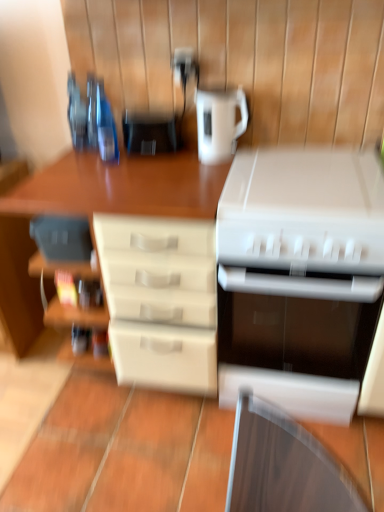
Question: Is matte black coffee maker at center, the 2th appliance from the bottom, smaller than white plastic printer at lower right, placed as the 1th kitchen appliance when sorted from bottom to top?

Choices:
 (A) no
 (B) yes

Answer: (B)

Question: From the image's perspective, is matte black coffee maker at center, which appears as the 1th appliance when viewed from the top, on white plastic printer at lower right, placed as the 1th kitchen appliance when sorted from bottom to top?

Choices:
 (A) no
 (B) yes

Answer: (B)

Question: Does matte black coffee maker at center, which appears as the 2th appliance when viewed from the right, have a greater height compared to white plastic printer at lower right, the 2th kitchen appliance in the top-to-bottom sequence?

Choices:
 (A) no
 (B) yes

Answer: (A)

Question: Is matte black coffee maker at center, the 2th appliance from the bottom, shorter than white plastic printer at lower right, the 2th kitchen appliance in the top-to-bottom sequence?

Choices:
 (A) yes
 (B) no

Answer: (A)

Question: From a real-world perspective, is matte black coffee maker at center, which is counted as the first appliance, starting from the left, below white plastic printer at lower right, the 2th kitchen appliance in the top-to-bottom sequence?

Choices:
 (A) no
 (B) yes

Answer: (A)

Question: Is matte black coffee maker at center, which appears as the 2th appliance when viewed from the right, bigger than white plastic printer at lower right, placed as the 1th kitchen appliance when sorted from bottom to top?

Choices:
 (A) no
 (B) yes

Answer: (A)

Question: Is white plastic printer at center not within matte black coffee maker at center, which is counted as the first appliance, starting from the left?

Choices:
 (A) yes
 (B) no

Answer: (A)

Question: Is white plastic printer at center thinner than matte black coffee maker at center, which is counted as the first appliance, starting from the left?

Choices:
 (A) yes
 (B) no

Answer: (B)

Question: Is matte black coffee maker at center, the 2th appliance from the bottom, surrounded by white plastic printer at center?

Choices:
 (A) yes
 (B) no

Answer: (B)

Question: Considering the relative sizes of white plastic printer at center and matte black coffee maker at center, which appears as the 2th appliance when viewed from the right, in the image provided, is white plastic printer at center smaller than matte black coffee maker at center, which appears as the 2th appliance when viewed from the right,?

Choices:
 (A) no
 (B) yes

Answer: (A)

Question: Is the depth of white plastic printer at center less than that of matte black coffee maker at center, which appears as the 2th appliance when viewed from the right?

Choices:
 (A) yes
 (B) no

Answer: (A)

Question: From the image's perspective, is white plastic printer at center beneath matte black coffee maker at center, the 2th appliance from the bottom?

Choices:
 (A) yes
 (B) no

Answer: (A)

Question: From the image's perspective, is matte white drawers at center above white plastic printer at center, the second appliance viewed from the top?

Choices:
 (A) no
 (B) yes

Answer: (A)